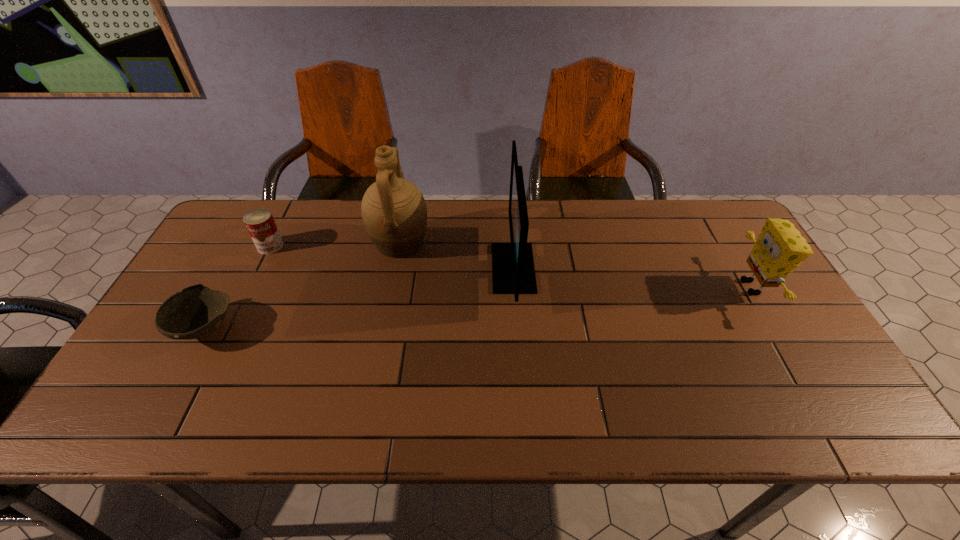
The height and width of the screenshot is (540, 960). In order to click on vacant space located 0.360m on the face of the third tallest object in this screenshot , I will do `click(606, 287)`.

The image size is (960, 540). What are the coordinates of `free spot located 0.340m on the face of the third tallest object` in the screenshot? It's located at (613, 287).

Locate an element on the screen. This screenshot has width=960, height=540. vacant space located on the face of the third tallest object is located at coordinates (703, 287).

At what (x,y) coordinates should I click in order to perform the action: click on free space located on the front label of the can. Please return your answer as a coordinate pair (x, y). Looking at the image, I should click on (256, 274).

Find the location of a particular element. Image resolution: width=960 pixels, height=540 pixels. vacant space positioned 0.120m on the back of the shortest object is located at coordinates coord(235,271).

In order to click on pitcher positioned at the far edge in this screenshot , I will do `click(394, 212)`.

This screenshot has width=960, height=540. I want to click on monitor that is at the far edge, so click(x=513, y=272).

The height and width of the screenshot is (540, 960). In order to click on can that is at the far edge in this screenshot , I will do `click(260, 223)`.

This screenshot has height=540, width=960. In order to click on can positioned at the left edge in this screenshot , I will do `click(260, 223)`.

What are the coordinates of `bowl that is at the left edge` in the screenshot? It's located at (197, 311).